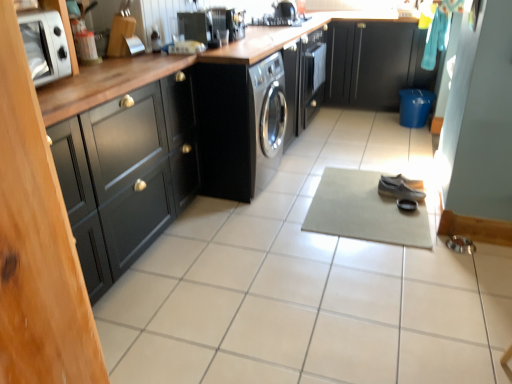
Where is `free space to the left of leather at center, the second shoe viewed from the front`? The width and height of the screenshot is (512, 384). free space to the left of leather at center, the second shoe viewed from the front is located at coordinates (366, 184).